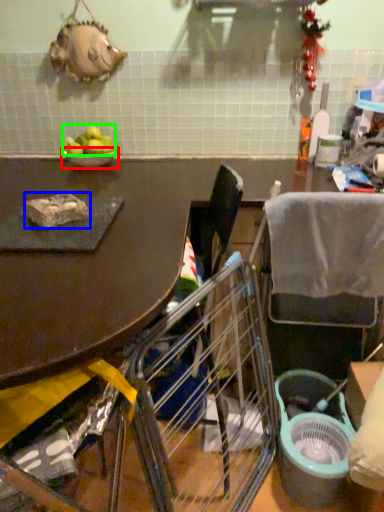
Question: Which is farther away from bowl (highlighted by a red box)? food (highlighted by a blue box) or fruit (highlighted by a green box)?

Choices:
 (A) food
 (B) fruit

Answer: (A)